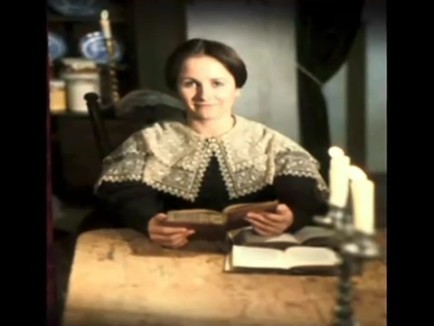
Find the location of a particular element. Image resolution: width=434 pixels, height=326 pixels. china plates is located at coordinates (57, 49), (96, 47).